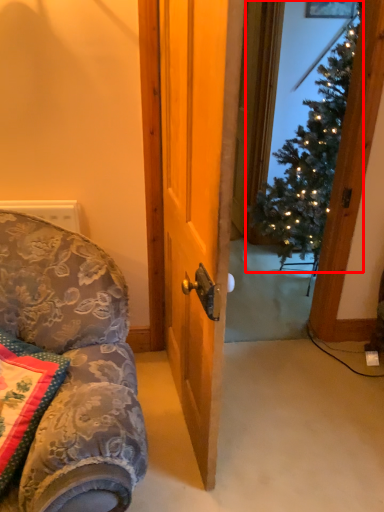
Question: In this image, where is christmas tree (annotated by the red box) located relative to pillow?

Choices:
 (A) left
 (B) right

Answer: (B)